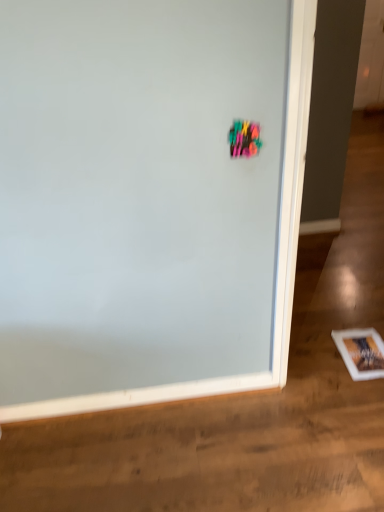
Locate an element on the screen. free spot to the left of white matte picture frame at lower right is located at coordinates (317, 356).